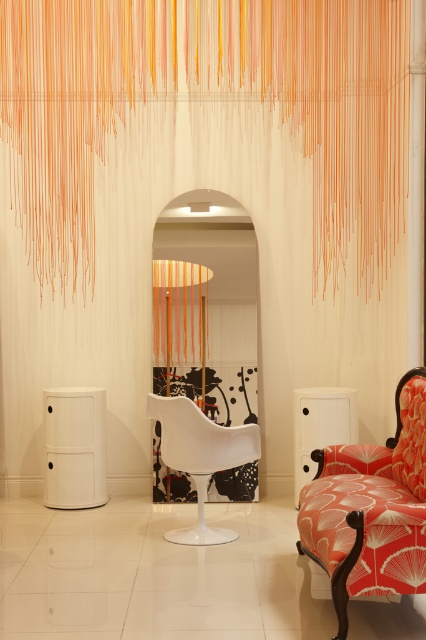
You are a guest entering the room and want to sit in the most comfortable chair. The orange floral fabric armchair at right and the white matte armchair at center are both available. Which chair is taller?

The orange floral fabric armchair at right is taller than the white matte armchair at center.

What object is located at the coordinates point (322,106) in the image?

The orange string curtain at upper center is located at point (322,106).